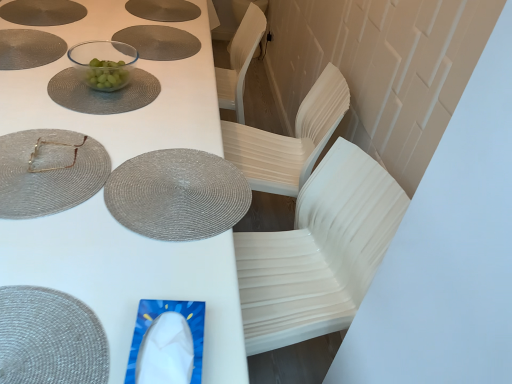
Locate an element on the screen. This screenshot has width=512, height=384. vacant space behind clear glass bowl at upper center, marked as the 1th tableware in a top-to-bottom arrangement is located at coordinates (111, 56).